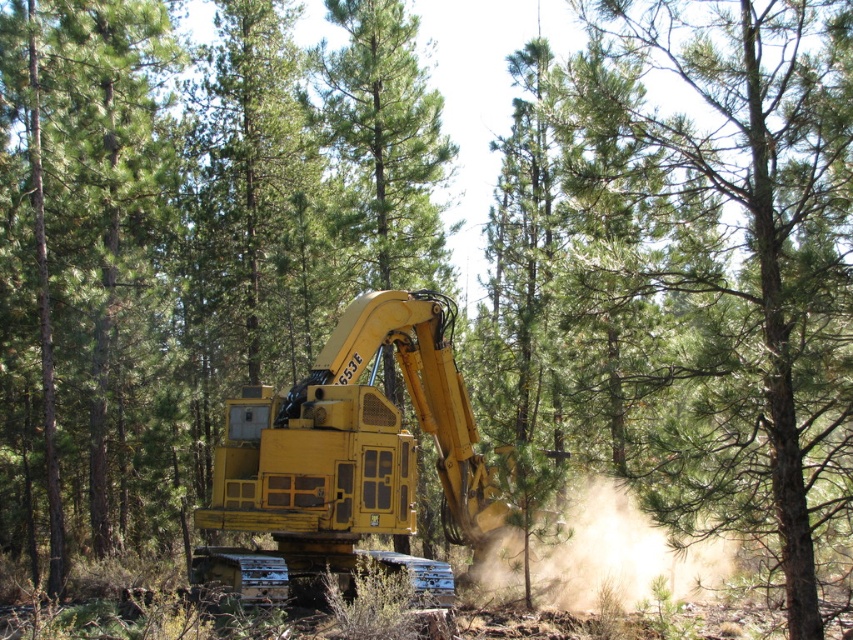
You are a safety inspector assessing the excavator site. You notice the green leafy tree at center and the brown dusty cloud at center. Which object is wider in the image?

The green leafy tree at center is wider than the brown dusty cloud at center according to the description.

You are a safety inspector assessing the scene. The green matte tree at center and the brown dusty cloud at center are both present. Which object is taller?

The green matte tree at center is much taller than the brown dusty cloud at center.

You are a forester planning to plant a new sapling in the forest. The excavator 653E is currently digging near the green matte tree at center. Based on the coordinates provided, can you determine the exact location to plant the sapling?

The green matte tree at center is located at coordinates point (76, 253), so you should plant the sapling at that exact position.